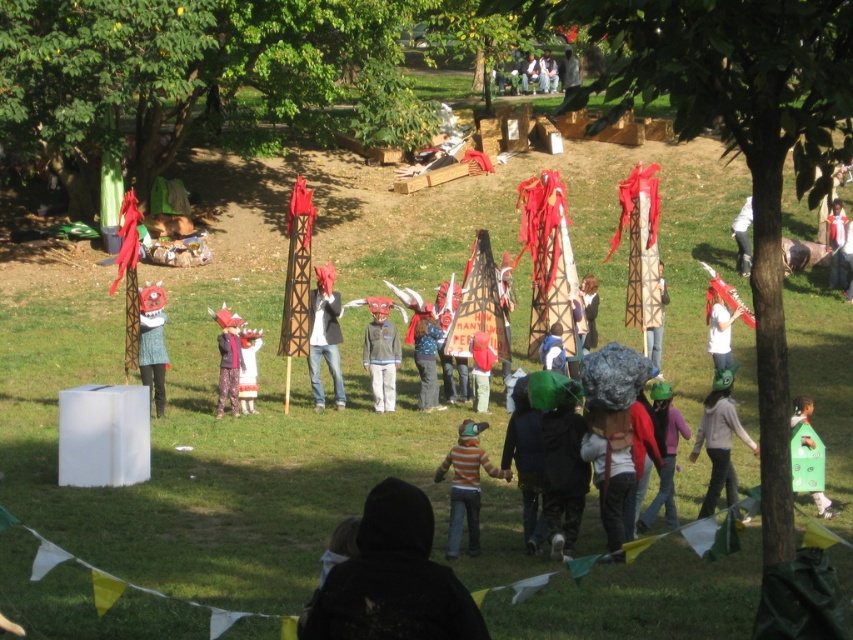
You are a photographer standing in the park and want to take a photo of both the striped cotton shirt at center and the green fabric costume at center. Which one should you focus on first to ensure both are in sharp focus?

You should focus on the striped cotton shirt at center first because it is closer to the viewer than the green fabric costume at center. By focusing on the closer object, the depth of field may include the farther one as well.

You are standing at the center of the park and see two points marked in the image. The first point is at coordinate point (x=158, y=333) and the second is at point (x=728, y=326). Which point is closer to you?

Point (x=158, y=333) is in front of point (x=728, y=326), so it is closer to you.